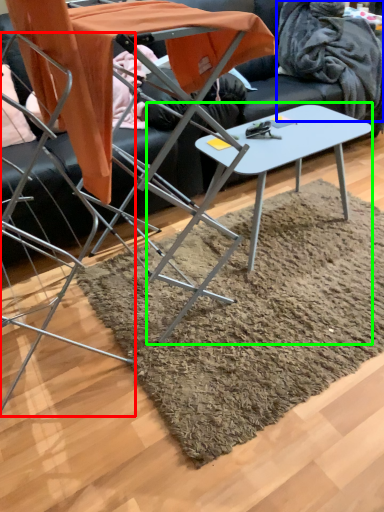
Question: Which object is positioned closest to chair (highlighted by a red box)? Select from blanket (highlighted by a blue box) and table (highlighted by a green box).

Choices:
 (A) blanket
 (B) table

Answer: (B)